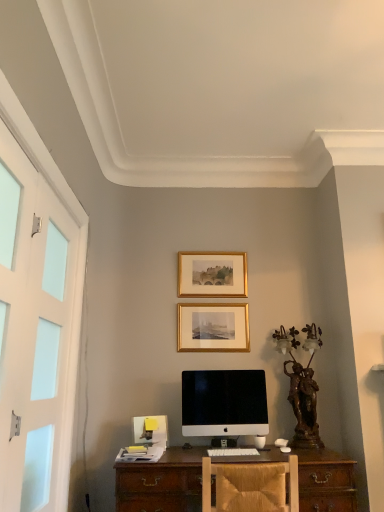
Question: In terms of height, does gold metallic picture frame at center, positioned as the 1th picture frame in bottom-to-top order, look taller or shorter compared to white matte screen door at left?

Choices:
 (A) short
 (B) tall

Answer: (A)

Question: Based on their positions, is gold metallic picture frame at center, positioned as the 1th picture frame in bottom-to-top order, located to the left or right of white matte screen door at left?

Choices:
 (A) right
 (B) left

Answer: (A)

Question: Estimate the real-world distances between objects in this image. Which object is farther from the gold metallic picture frame at center, which is the second picture frame from top to bottom?

Choices:
 (A) sleek white monitor at center
 (B) bronze statue at right
 (C) gold/gilded picture frame at upper center, the 1th picture frame positioned from the top
 (D) wooden chair at center
 (E) white matte screen door at left

Answer: (E)

Question: Estimate the real-world distances between objects in this image. Which object is farther from the gold/gilded picture frame at upper center, the 1th picture frame positioned from the top?

Choices:
 (A) sleek white monitor at center
 (B) bronze statue at right
 (C) gold metallic picture frame at center, which is the second picture frame from top to bottom
 (D) white matte screen door at left
 (E) wooden chair at center

Answer: (E)